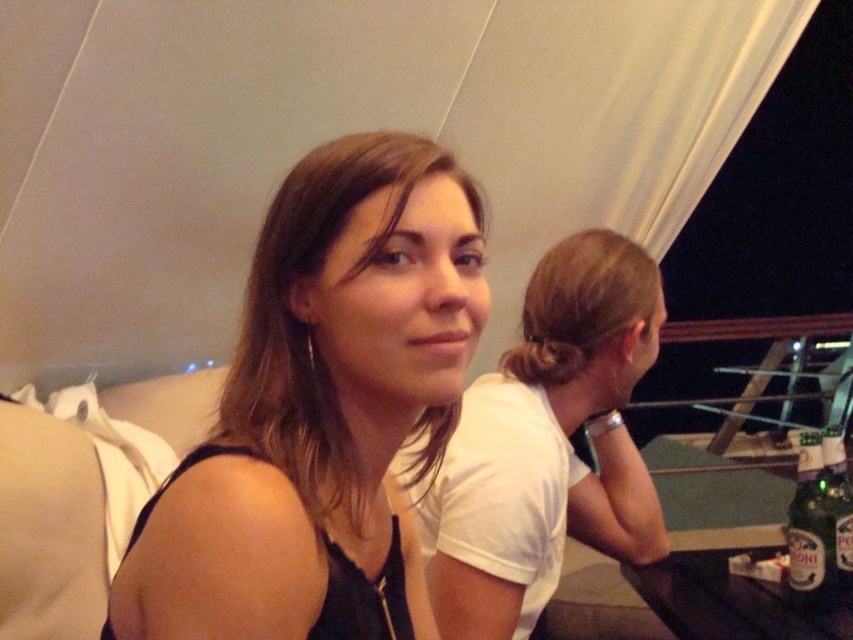
Question: Can you confirm if matte black top at center is smaller than translucent glass bottle at lower right?

Choices:
 (A) yes
 (B) no

Answer: (B)

Question: Is matte black hair at center to the left of translucent glass bottle at lower right from the viewer's perspective?

Choices:
 (A) no
 (B) yes

Answer: (B)

Question: Which object appears farthest from the camera in this image?

Choices:
 (A) matte black hair at center
 (B) translucent glass bottle at lower right
 (C) matte black top at center

Answer: (B)

Question: Which of the following is the closest to the observer?

Choices:
 (A) (827, 637)
 (B) (469, 598)
 (C) (825, 444)
 (D) (828, 579)

Answer: (A)

Question: Can you confirm if matte black top at center is positioned to the right of matte black hair at center?

Choices:
 (A) yes
 (B) no

Answer: (B)

Question: Estimate the real-world distances between objects in this image. Which object is farther from the black plastic table at lower right?

Choices:
 (A) matte black top at center
 (B) translucent glass bottle at lower right

Answer: (A)